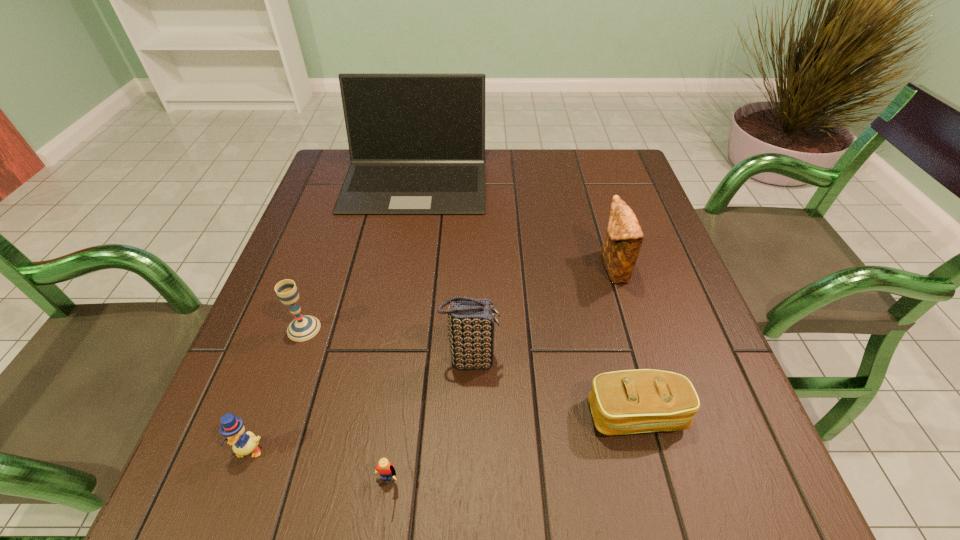
This screenshot has height=540, width=960. In the image, there is a desktop. In order to click on vacant space at the far right corner in this screenshot , I will do tap(624, 174).

Find the location of a particular element. The image size is (960, 540). vacant space that is in between the nearest clutch bag and the second farthest clutch bag is located at coordinates (553, 387).

This screenshot has height=540, width=960. In order to click on empty space between the second farthest clutch bag and the Lego in this screenshot , I will do `click(429, 423)`.

Where is `free spot between the second farthest clutch bag and the laptop`? The width and height of the screenshot is (960, 540). free spot between the second farthest clutch bag and the laptop is located at coordinates (443, 271).

The width and height of the screenshot is (960, 540). What are the coordinates of `empty space that is in between the tallest object and the chalice` in the screenshot? It's located at (359, 255).

Where is `free space between the farthest object and the leftmost clutch bag`? This screenshot has height=540, width=960. free space between the farthest object and the leftmost clutch bag is located at coordinates pos(443,271).

The image size is (960, 540). Find the location of `vacant region between the Lego and the nearest clutch bag`. vacant region between the Lego and the nearest clutch bag is located at coordinates (512, 451).

Image resolution: width=960 pixels, height=540 pixels. In order to click on blank region between the nearest object and the farthest object in this screenshot , I will do `click(401, 334)`.

The width and height of the screenshot is (960, 540). In order to click on free area in between the tallest object and the nearest clutch bag in this screenshot , I will do `click(526, 298)`.

Where is `empty location between the chalice and the shortest clutch bag`? empty location between the chalice and the shortest clutch bag is located at coordinates (470, 372).